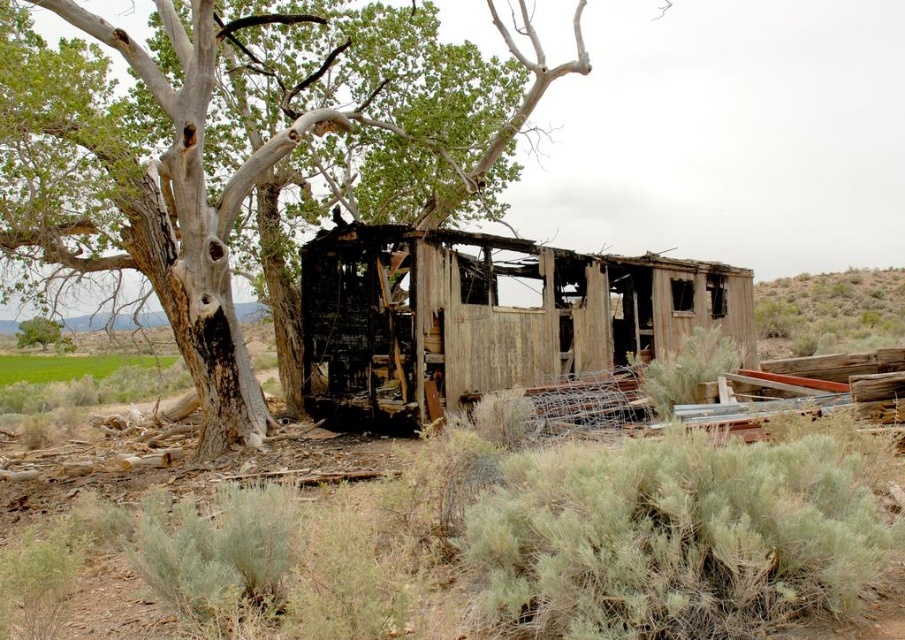
Can you confirm if gray bark tree at center is positioned to the left of weathered wood hut at center?

Indeed, gray bark tree at center is positioned on the left side of weathered wood hut at center.

Who is positioned more to the left, gray bark tree at center or weathered wood hut at center?

Positioned to the left is gray bark tree at center.

Is point (184, 1) positioned before point (537, 320)?

No, it is behind (537, 320).

Locate an element on the screen. gray bark tree at center is located at coordinates (274, 157).

Who is lower down, weathered wood hut at center or green shrubbery at right?

weathered wood hut at center is lower down.

Describe the element at coordinates (488, 317) in the screenshot. I see `weathered wood hut at center` at that location.

Identify the location of weathered wood hut at center. The width and height of the screenshot is (905, 640). (488, 317).

Who is more distant from viewer, (x=420, y=188) or (x=770, y=337)?

Point (x=770, y=337)

Measure the distance between gray bark tree at center and green shrubbery at right.

They are 22.35 meters apart.

Does point (565, 72) come farther from viewer compared to point (872, 300)?

No, it is in front of (872, 300).

Where is `gray bark tree at center`? gray bark tree at center is located at coordinates (274, 157).